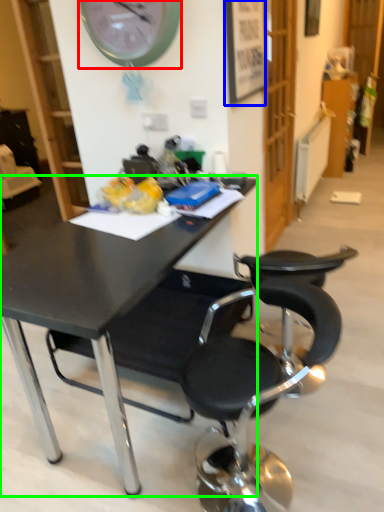
Question: Considering the real-world distances, which object is closest to wall clock (highlighted by a red box)? picture frame (highlighted by a blue box) or desk (highlighted by a green box).

Choices:
 (A) picture frame
 (B) desk

Answer: (A)